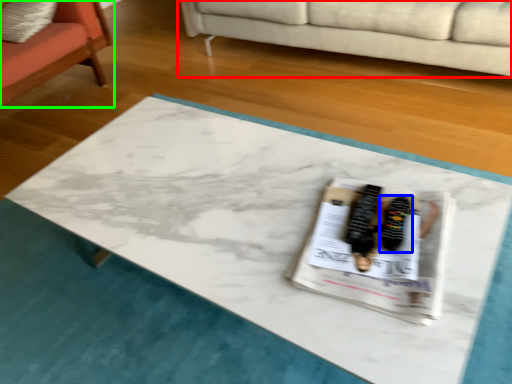
Question: Estimate the real-world distances between objects in this image. Which object is farther from studio couch (highlighted by a red box), footwear (highlighted by a blue box) or chair (highlighted by a green box)?

Choices:
 (A) footwear
 (B) chair

Answer: (A)